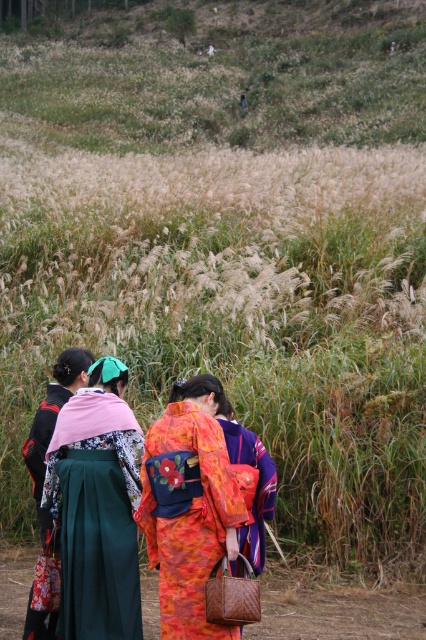
Question: Based on their relative distances, which object is nearer to the green satin kimono at center?

Choices:
 (A) floral kimono at center
 (B) orange silk kimono at center

Answer: (A)

Question: Can you confirm if green satin kimono at center is bigger than matte black kimono at left?

Choices:
 (A) no
 (B) yes

Answer: (B)

Question: Does green satin kimono at center come in front of orange silk kimono at center?

Choices:
 (A) yes
 (B) no

Answer: (B)

Question: Which of the following is the farthest from the observer?

Choices:
 (A) matte black kimono at left
 (B) green satin kimono at center

Answer: (A)

Question: Is green satin kimono at center smaller than orange silk kimono at center?

Choices:
 (A) yes
 (B) no

Answer: (B)

Question: Which point is closer to the camera?

Choices:
 (A) matte black kimono at left
 (B) floral kimono at center
 (C) green satin kimono at center

Answer: (B)